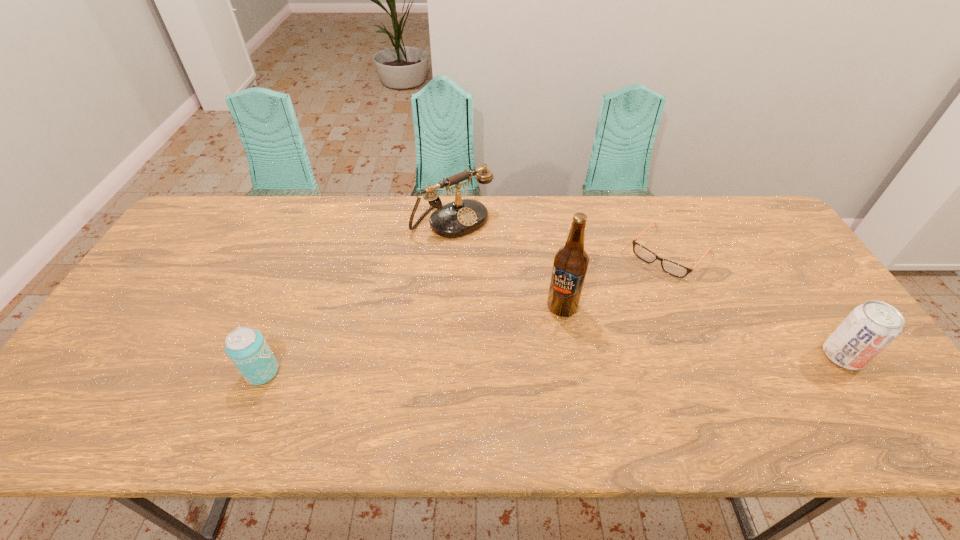
Identify the location of vacant space at the far right corner. The width and height of the screenshot is (960, 540). (740, 196).

The height and width of the screenshot is (540, 960). I want to click on unoccupied area between the telephone and the rightmost object, so click(647, 288).

Where is `free space between the soda can and the third object from left to right`? The image size is (960, 540). free space between the soda can and the third object from left to right is located at coordinates (702, 332).

Find the location of a particular element. This screenshot has width=960, height=540. vacant region between the leftmost object and the third object from left to right is located at coordinates (413, 340).

At what (x,y) coordinates should I click in order to perform the action: click on free area in between the soda can and the telephone. Please return your answer as a coordinate pair (x, y). Image resolution: width=960 pixels, height=540 pixels. Looking at the image, I should click on (647, 288).

Locate an element on the screen. The image size is (960, 540). free point between the rightmost object and the tallest object is located at coordinates (702, 332).

Where is `free space that is in between the second object from right to left and the soda can`? This screenshot has width=960, height=540. free space that is in between the second object from right to left and the soda can is located at coordinates click(756, 304).

The image size is (960, 540). Identify the location of free spot between the telephone and the leftmost object. (357, 297).

Identify the location of vacant area that lies between the fourth object from right to left and the beer can. (357, 297).

The image size is (960, 540). I want to click on free space between the soda can and the second shortest object, so click(552, 364).